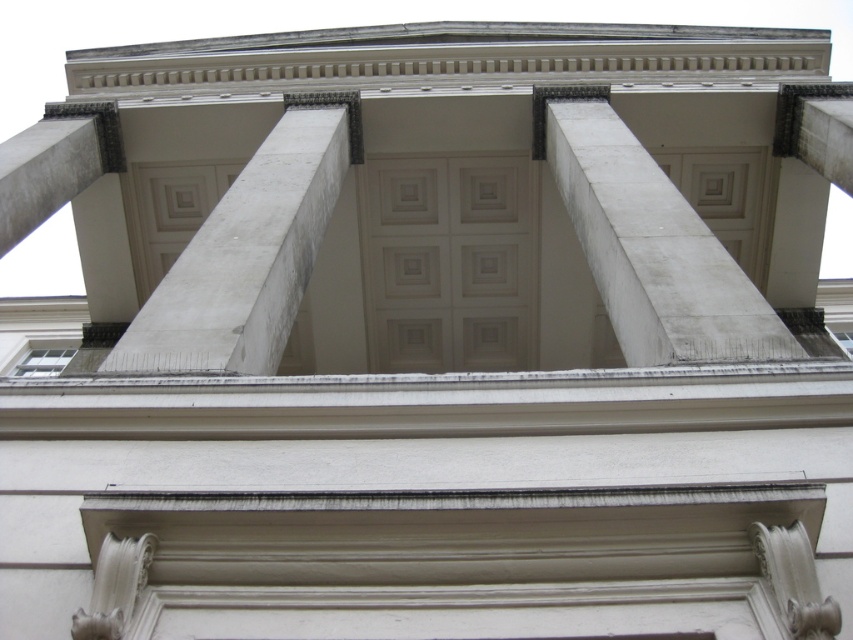
From the picture: You are an architect designing a new building and want to ensure that the columns align with the existing classical structure. Given that you have both the white concrete column at center and the white marble pillar at center in your design, which one should you choose if you want the column to match the height of the existing classical columns shown in the image?

The white marble pillar at center is taller than the white concrete column at center, so to match the height of the existing classical columns, you should choose the white marble pillar at center.

You are an architect examining the classical structure. You notice the white concrete column at center and the white marble pillar at center. Which one is located above the other?

The white concrete column at center is positioned over the white marble pillar at center.